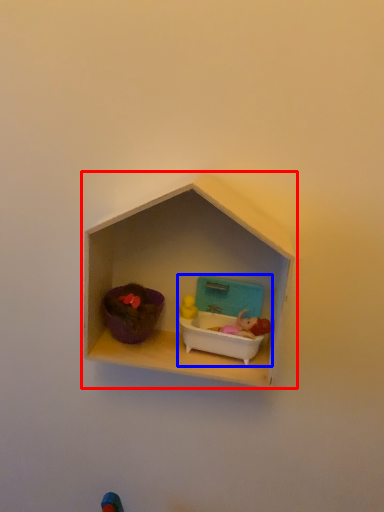
Question: Which object is further to the camera taking this photo, shelf (highlighted by a red box) or toy (highlighted by a blue box)?

Choices:
 (A) shelf
 (B) toy

Answer: (B)